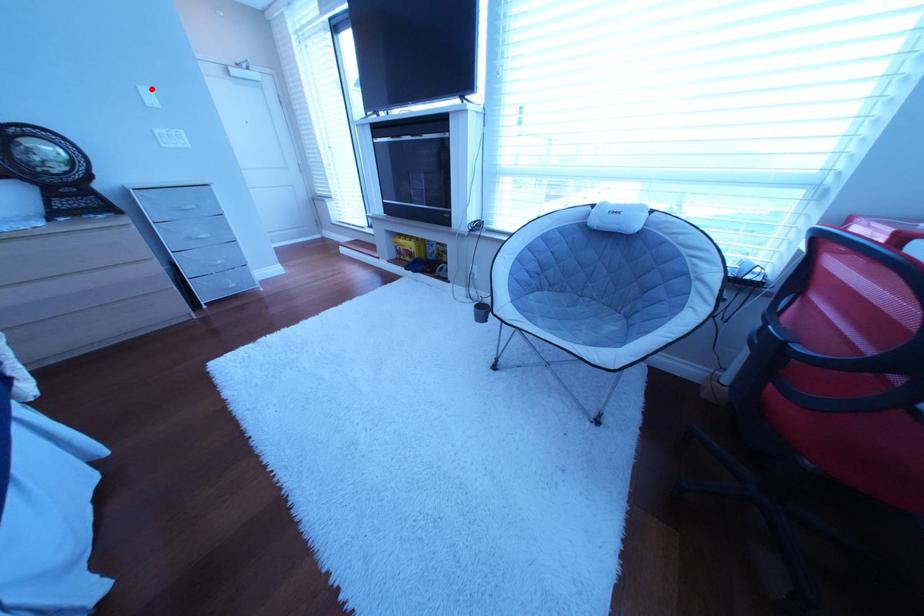
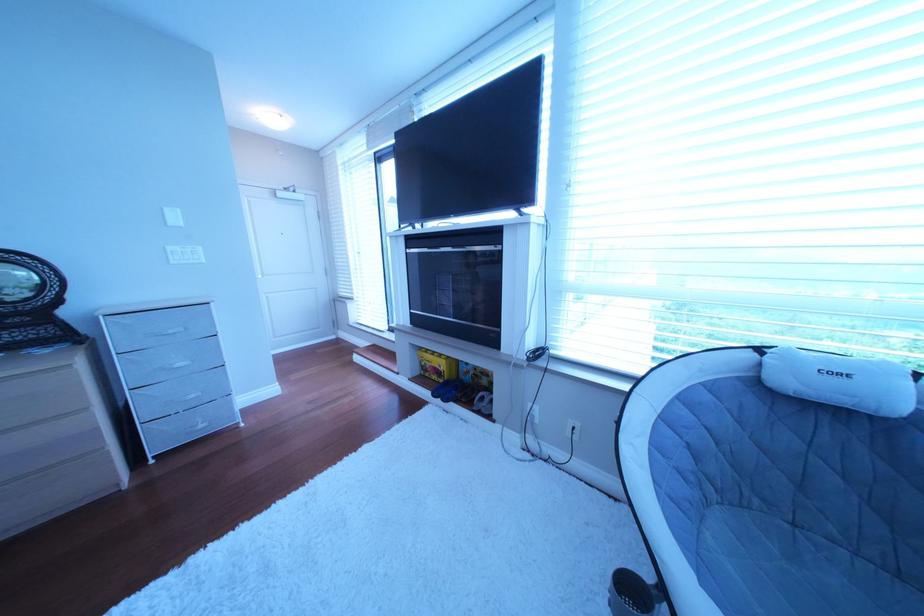
Locate, in the second image, the point that corresponds to the highlighted location in the first image.

(177, 211)